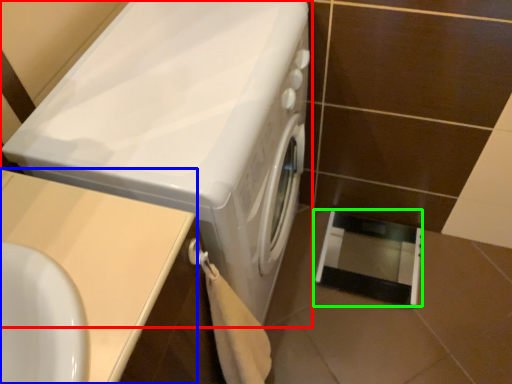
Question: Based on their relative distances, which object is nearer to washing machine (highlighted by a red box)? Choose from counter top (highlighted by a blue box) and screen door (highlighted by a green box).

Choices:
 (A) counter top
 (B) screen door

Answer: (A)